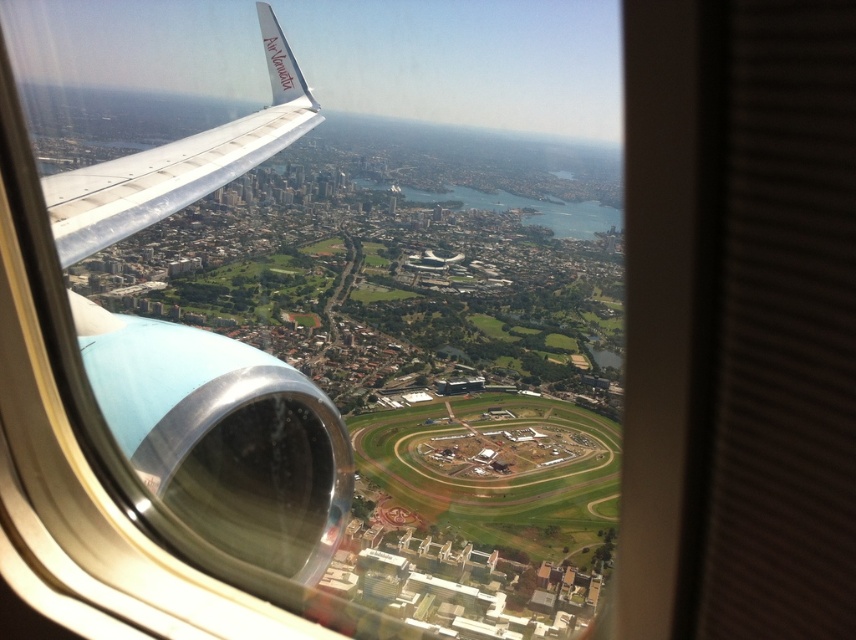
Who is positioned more to the left, metallic silver wing at left or white matte wing at upper left?

Positioned to the left is white matte wing at upper left.

Which is above, metallic silver wing at left or white matte wing at upper left?

white matte wing at upper left is higher up.

You are a GUI agent. You are given a task and a screenshot of the screen. Output one action in this format:
    pyautogui.click(x=<x>, y=<y>)
    Task: Click on the metallic silver wing at left
    
    Given the screenshot: What is the action you would take?
    pyautogui.click(x=223, y=436)